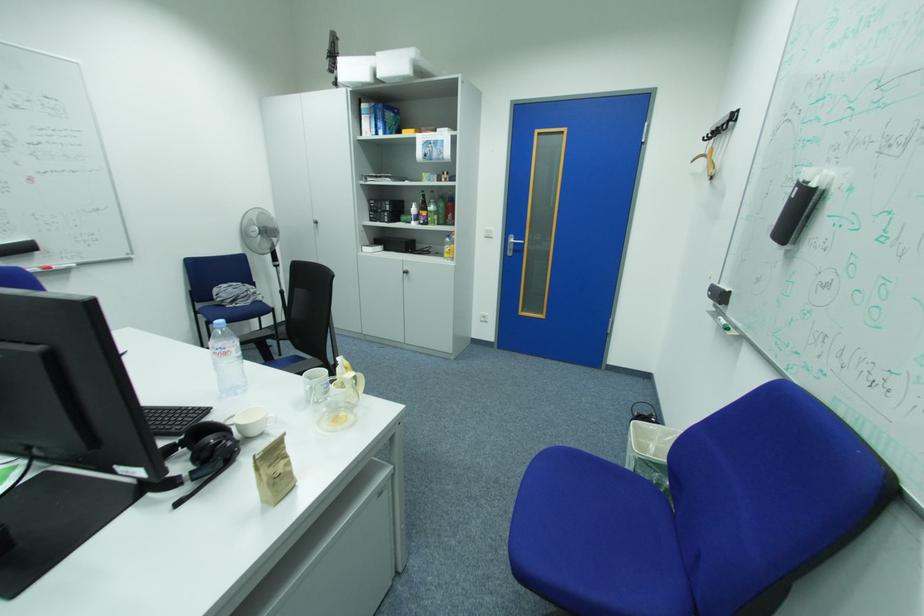
Identify the location of white mug handle. The height and width of the screenshot is (616, 924). (314, 384).